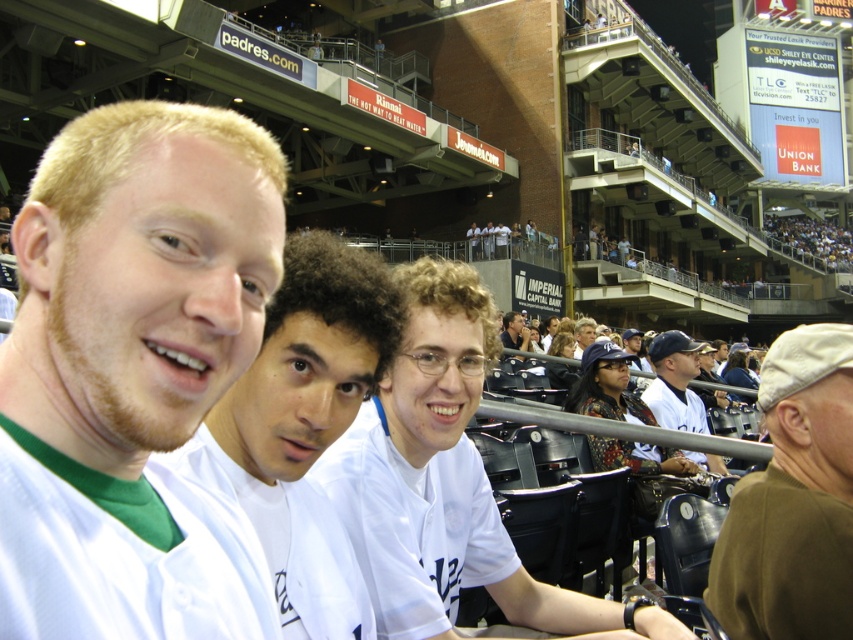
Consider the image. You are a photographer standing in the baseball stadium and want to take a picture of the white jersey at center and the matte white shirt at center. Which one will appear larger in your photo?

The white jersey at center will appear larger in the photo because it is closer to the viewer than the matte white shirt at center.

You are a photographer at the baseball stadium and want to take a clear photo of the person in the center. However, you notice that the matte white jersey at center and the matte white shirt at center might be overlapping. Which clothing item is covering the other?

The matte white jersey at center is positioned over the matte white shirt at center, so the jersey is covering the shirt.